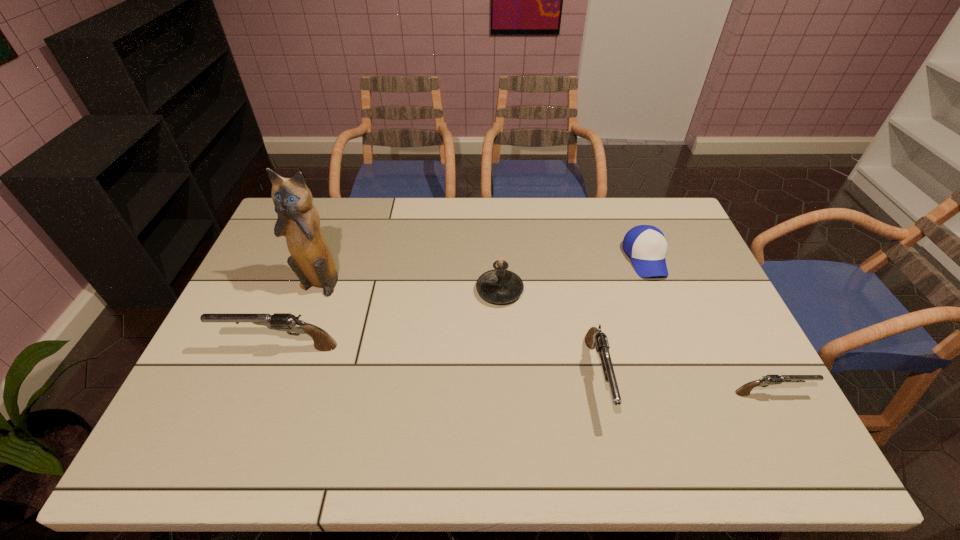
I want to click on vacant point located between the second object from right to left and the fourth tallest object, so click(x=621, y=318).

Where is `free space between the fifth object from left to right and the fourth object from left to right`? free space between the fifth object from left to right and the fourth object from left to right is located at coordinates (621, 318).

Identify the location of empty location between the shortest gun and the cat. The image size is (960, 540). click(x=545, y=337).

Identify the location of free space between the third shortest object and the fourth object from right to left. (549, 333).

The width and height of the screenshot is (960, 540). What are the coordinates of `free space that is in between the fifth object from left to right and the third object from right to left` in the screenshot? It's located at (621, 318).

Find the location of `object that can be found as the second closest to the rightmost gun`. object that can be found as the second closest to the rightmost gun is located at coordinates (646, 245).

Choose which object is the second nearest neighbor to the candle. Please provide its 2D coordinates. Your answer should be formatted as a tuple, i.e. [(x, y)], where the tuple contains the x and y coordinates of a point satisfying the conditions above.

[(646, 245)]

You are a GUI agent. You are given a task and a screenshot of the screen. Output one action in this format:
    pyautogui.click(x=<x>, y=<y>)
    Task: Click on the gun that can be found as the second closest to the tallest object
    
    Given the screenshot: What is the action you would take?
    pos(595,338)

Identify the location of gun identified as the second closest to the second gun from right to left. Image resolution: width=960 pixels, height=540 pixels. (288, 322).

What are the coordinates of `free space that satisfies the following two spatial constraints: 1. on the front-facing side of the second object from right to left; 2. aiming along the barrel of the leftmost gun` in the screenshot? It's located at (680, 347).